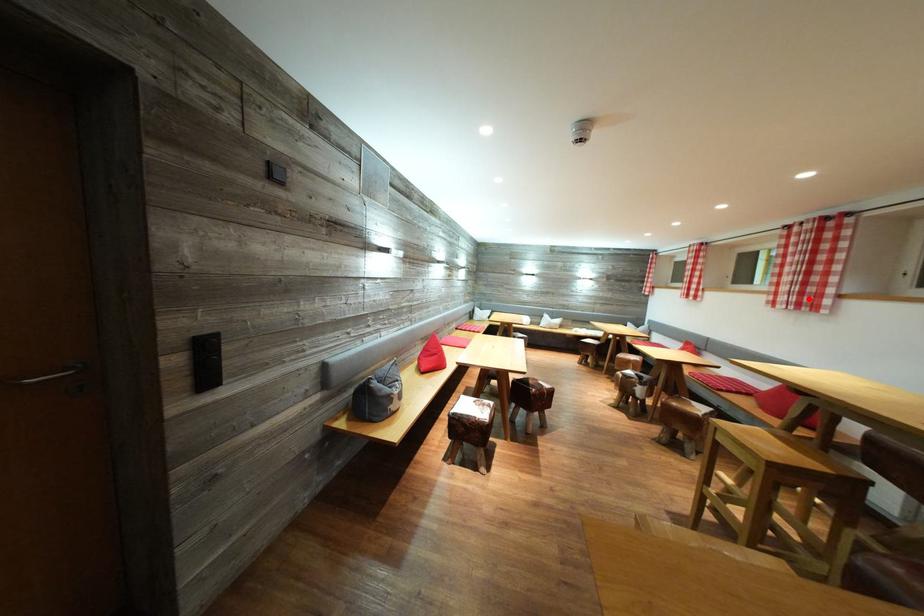
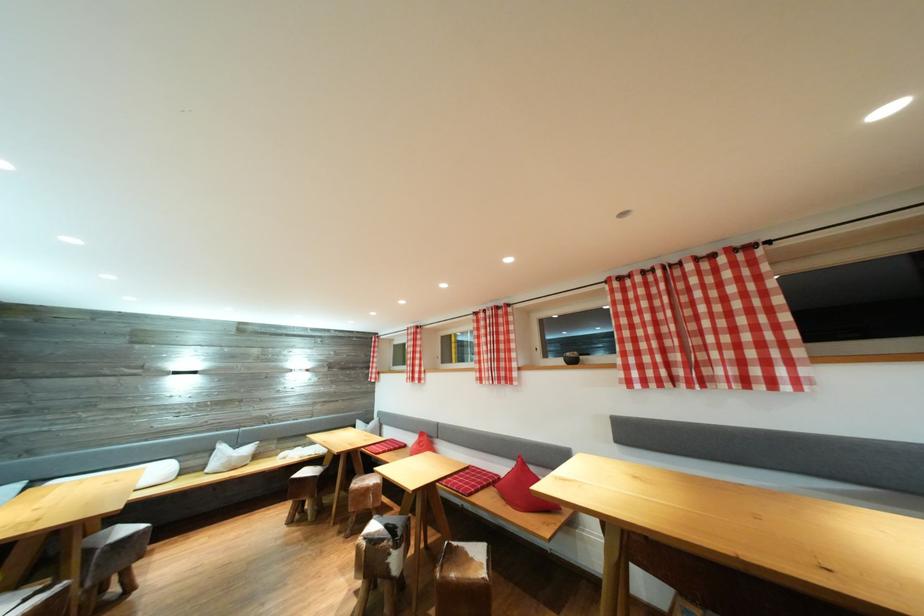
Question: I am providing you with two images of the same scene from different viewpoints. A red point is marked on the first image. At the location where the point appears in image 1, is it still visible in image 2?

Choices:
 (A) Yes
 (B) No

Answer: (A)